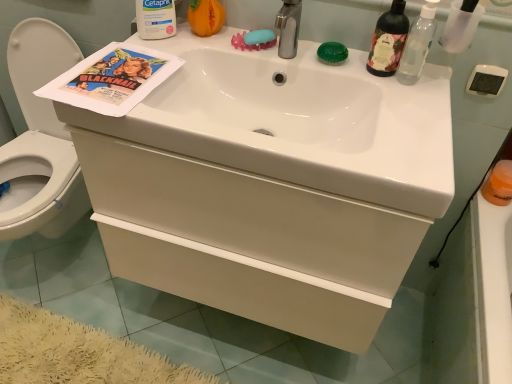
Where is `empty space that is ontop of matte paper poster at upper left (from a real-world perspective)`? The width and height of the screenshot is (512, 384). empty space that is ontop of matte paper poster at upper left (from a real-world perspective) is located at coordinates (114, 72).